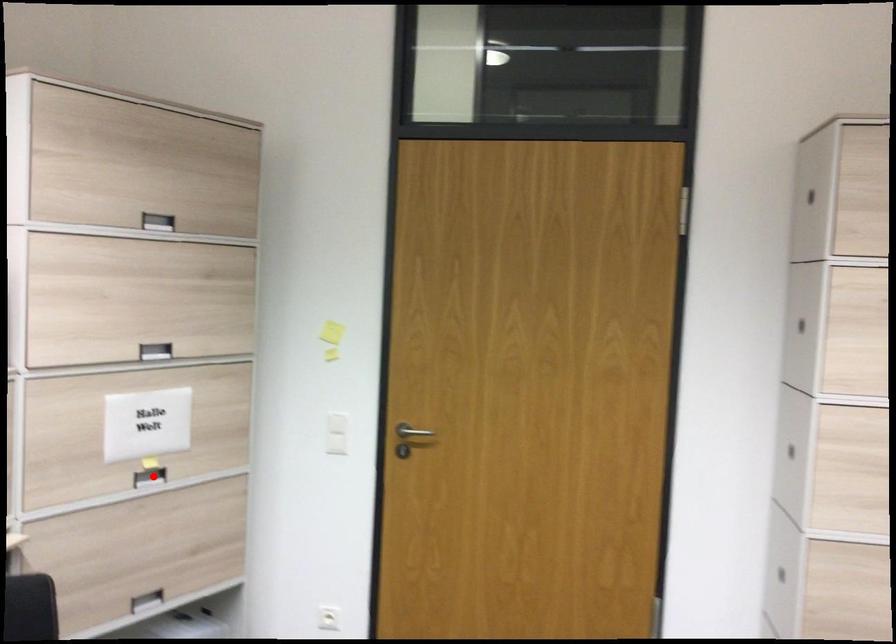
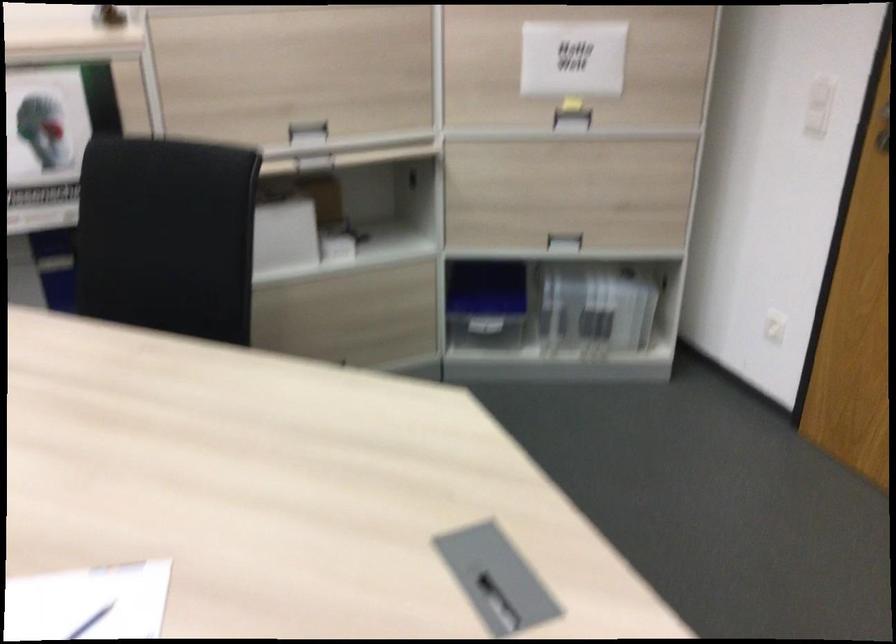
Where in the second image is the point corresponding to the highlighted location from the first image?

(572, 120)